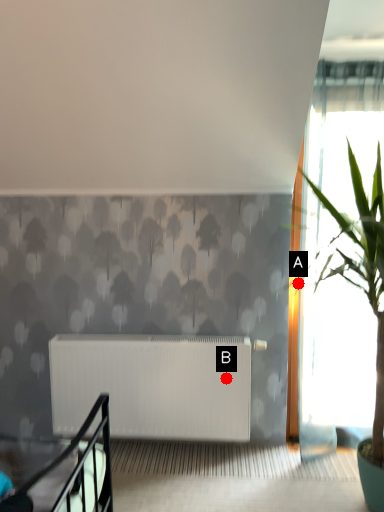
Question: Two points are circled on the image, labeled by A and B beside each circle. Which point is farther from the camera taking this photo?

Choices:
 (A) A is further
 (B) B is further

Answer: (A)